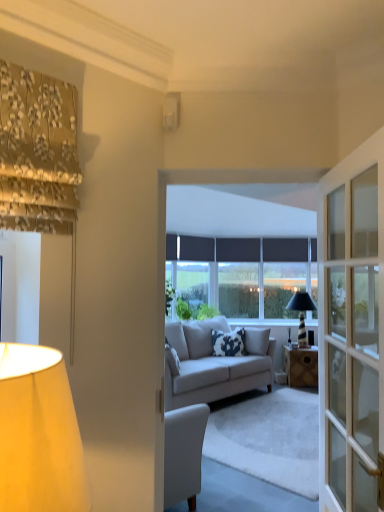
Question: From a real-world perspective, is black glass lamp at center, the third lamp viewed from the front, below matte black window at center?

Choices:
 (A) yes
 (B) no

Answer: (A)

Question: From the image's perspective, is black glass lamp at center, the 1th lamp in the right-to-left sequence, located above matte black window at center?

Choices:
 (A) no
 (B) yes

Answer: (A)

Question: Considering the relative sizes of black glass lamp at center, which is the third lamp in left-to-right order, and matte black window at center in the image provided, is black glass lamp at center, which is the third lamp in left-to-right order, shorter than matte black window at center?

Choices:
 (A) no
 (B) yes

Answer: (B)

Question: Would you say black glass lamp at center, the 1th lamp in the right-to-left sequence, is outside matte black window at center?

Choices:
 (A) no
 (B) yes

Answer: (B)

Question: From the image's perspective, is black glass lamp at center, the 1th lamp in the right-to-left sequence, beneath matte black window at center?

Choices:
 (A) yes
 (B) no

Answer: (A)

Question: From a real-world perspective, is black glass lamp at center, the 1th lamp in the right-to-left sequence, over matte black window at center?

Choices:
 (A) yes
 (B) no

Answer: (B)

Question: Would you say matte black window at center is a long distance from wooden desk at center?

Choices:
 (A) no
 (B) yes

Answer: (B)

Question: Does matte black window at center turn towards wooden desk at center?

Choices:
 (A) no
 (B) yes

Answer: (A)

Question: Does matte black window at center have a lesser width compared to wooden desk at center?

Choices:
 (A) no
 (B) yes

Answer: (B)

Question: Is matte black window at center turned away from wooden desk at center?

Choices:
 (A) no
 (B) yes

Answer: (A)

Question: Is matte black window at center outside of wooden desk at center?

Choices:
 (A) no
 (B) yes

Answer: (B)

Question: Does matte black window at center have a larger size compared to wooden desk at center?

Choices:
 (A) yes
 (B) no

Answer: (A)

Question: Does white fabric lampshade at left, the second lamp positioned from the top, have a greater height compared to white glossy switch at upper center, which is the 2th lamp from front to back?

Choices:
 (A) yes
 (B) no

Answer: (A)